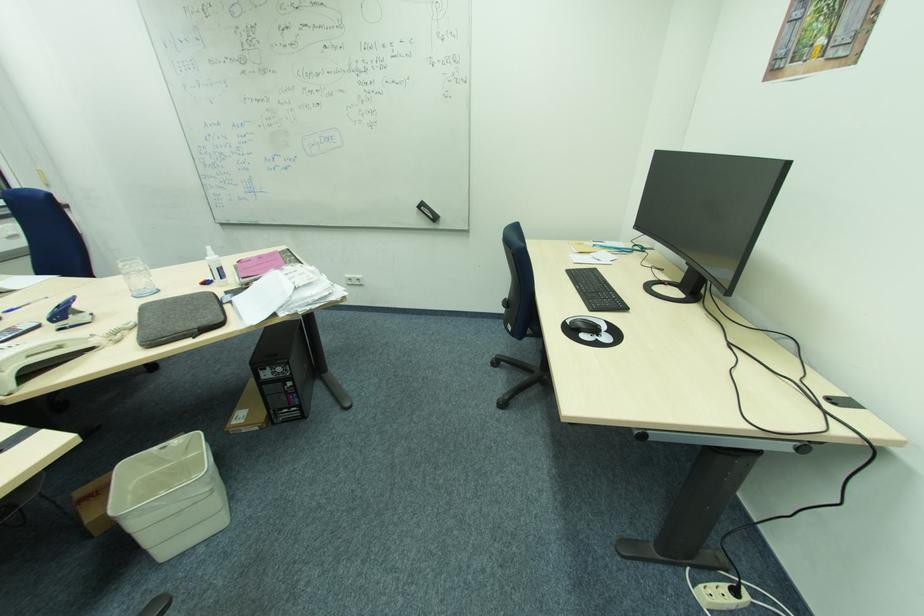
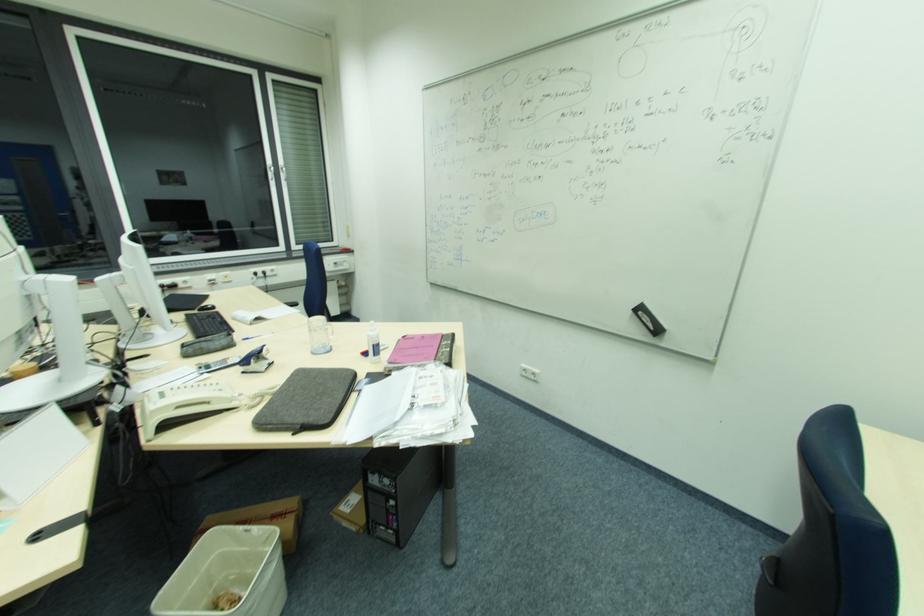
Where in the second image is the point corresponding to pixel 221 268 from the first image?

(375, 345)